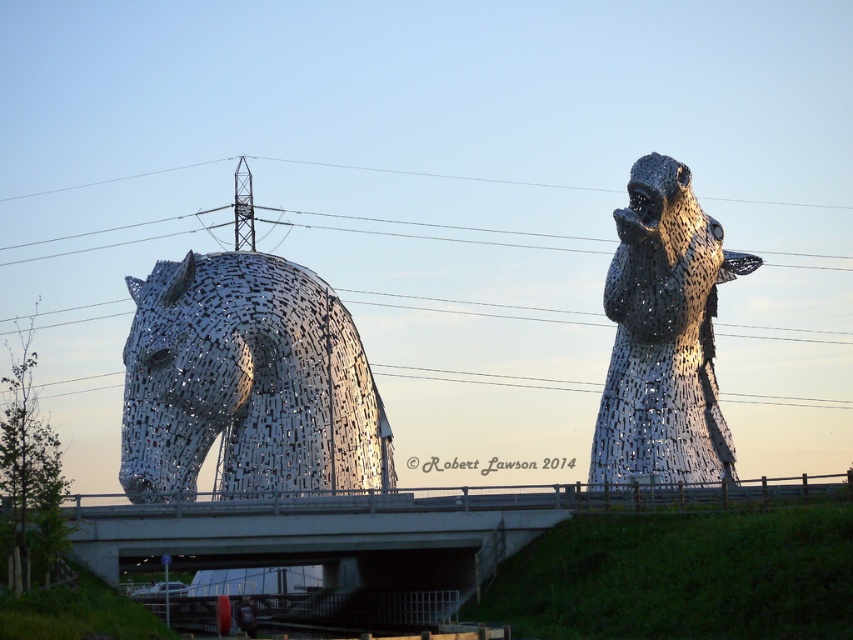
You are standing at the point marked as point (247, 381) in the image. Which direction should you look to see the metallic horse at left?

The metallic horse at left is located at point (247, 381), so you are already at its position. Therefore, you cannot see it from where you are standing.

You are a photographer planning to capture both the metallic horse at left and the metallic mosaic horse at right in a single shot. However, the road underpass bridge in the foreground is blocking your view. Can you adjust your position to ensure both sculptures are visible without obstruction?

The metallic horse at left is positioned under the metallic mosaic horse at right. Since the road underpass bridge is in the foreground, moving to a lower angle or position might allow you to capture both sculptures without the bridge blocking them, as the left horse is beneath the right one.